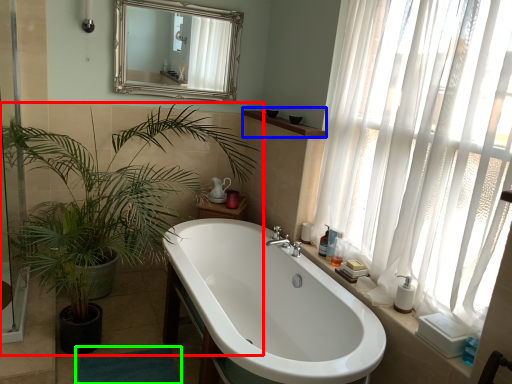
Question: Which object is the closest to the houseplant (highlighted by a red box)? Choose among these: window sill (highlighted by a blue box) or bath mat (highlighted by a green box).

Choices:
 (A) window sill
 (B) bath mat

Answer: (B)